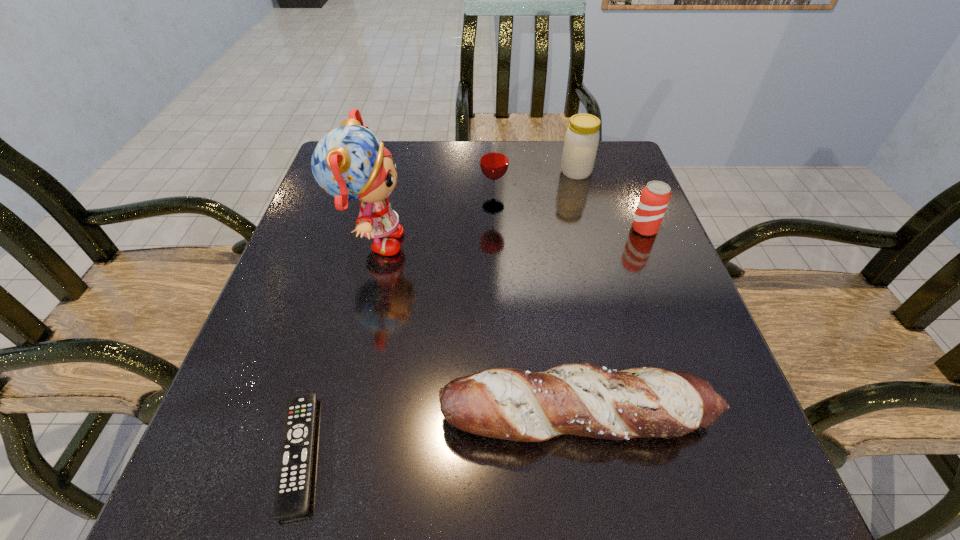
Image resolution: width=960 pixels, height=540 pixels. Identify the location of free space that satisfies the following two spatial constraints: 1. on the face of the second shortest object; 2. on the right side of the doll. (328, 416).